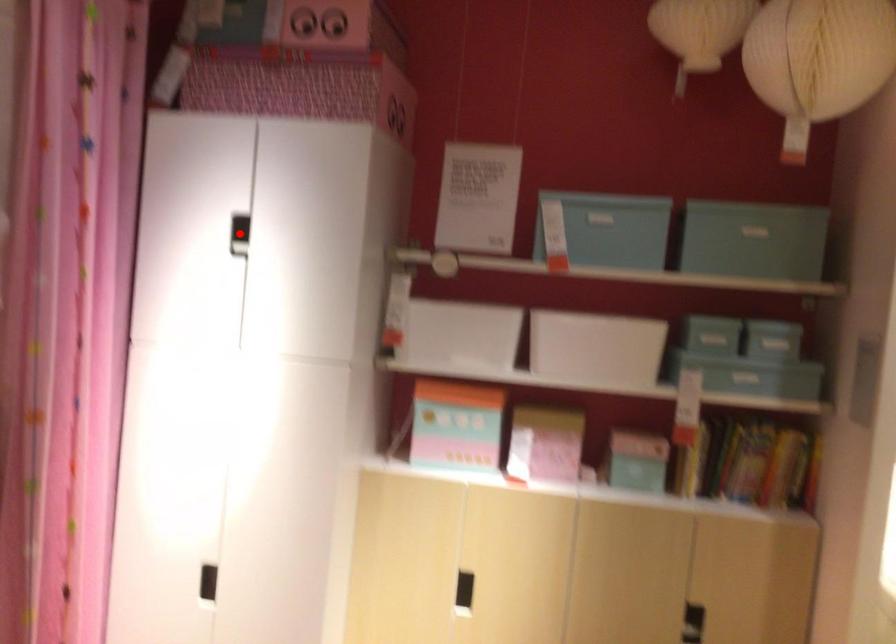
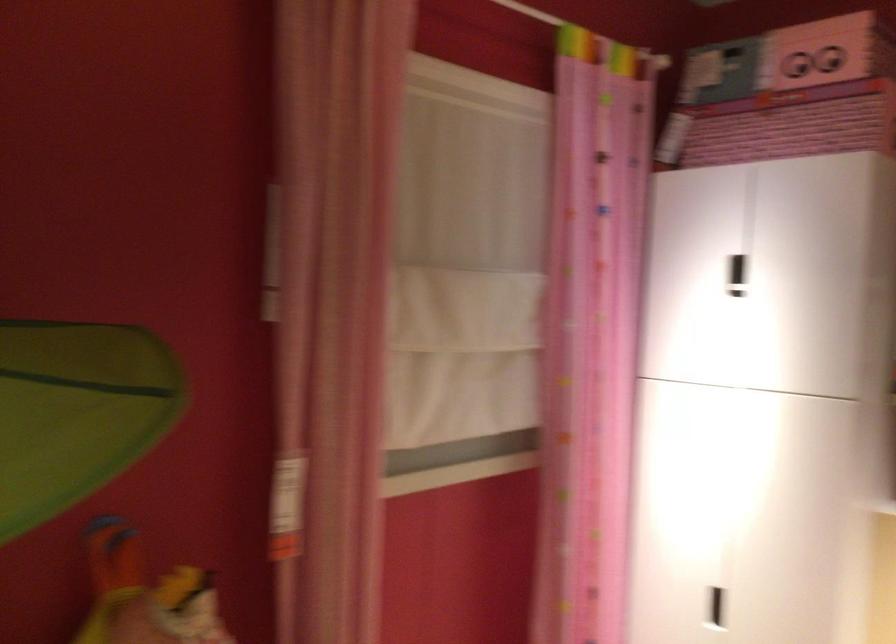
Question: I am providing you with two images of the same scene from different viewpoints. A red point is marked on the first image. Is the red point's position out of view in image 2?

Choices:
 (A) Yes
 (B) No

Answer: (A)